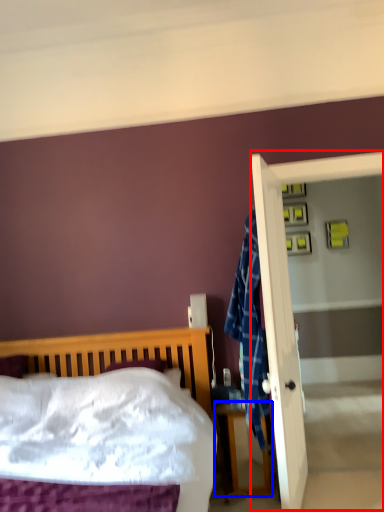
Question: Which point is further to the camera, screen door (highlighted by a red box) or nightstand (highlighted by a blue box)?

Choices:
 (A) screen door
 (B) nightstand

Answer: (A)